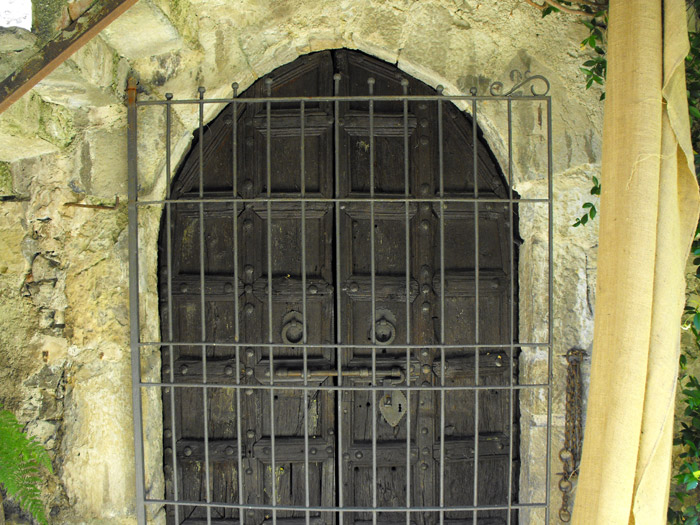
Where is `dark brown door`? This screenshot has height=525, width=700. dark brown door is located at coordinates (491, 243).